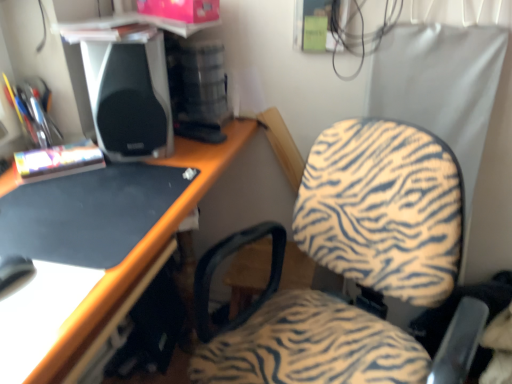
Question: Looking at the image, does zebra-patterned fabric chair at center seem bigger or smaller compared to satin black speaker at upper left?

Choices:
 (A) big
 (B) small

Answer: (A)

Question: Considering the positions of zebra-patterned fabric chair at center and satin black speaker at upper left in the image, is zebra-patterned fabric chair at center taller or shorter than satin black speaker at upper left?

Choices:
 (A) tall
 (B) short

Answer: (A)

Question: Which is correct: zebra-patterned fabric chair at center is inside satin black speaker at upper left, or outside of it?

Choices:
 (A) inside
 (B) outside

Answer: (B)

Question: Considering the relative positions of satin black speaker at upper left and zebra-patterned fabric chair at center in the image provided, is satin black speaker at upper left to the left or to the right of zebra-patterned fabric chair at center?

Choices:
 (A) right
 (B) left

Answer: (B)

Question: Relative to zebra-patterned fabric chair at center, is satin black speaker at upper left in front or behind?

Choices:
 (A) behind
 (B) front

Answer: (A)

Question: From a real-world perspective, is satin black speaker at upper left positioned above or below zebra-patterned fabric chair at center?

Choices:
 (A) below
 (B) above

Answer: (B)

Question: Is satin black speaker at upper left inside or outside of zebra-patterned fabric chair at center?

Choices:
 (A) outside
 (B) inside

Answer: (A)